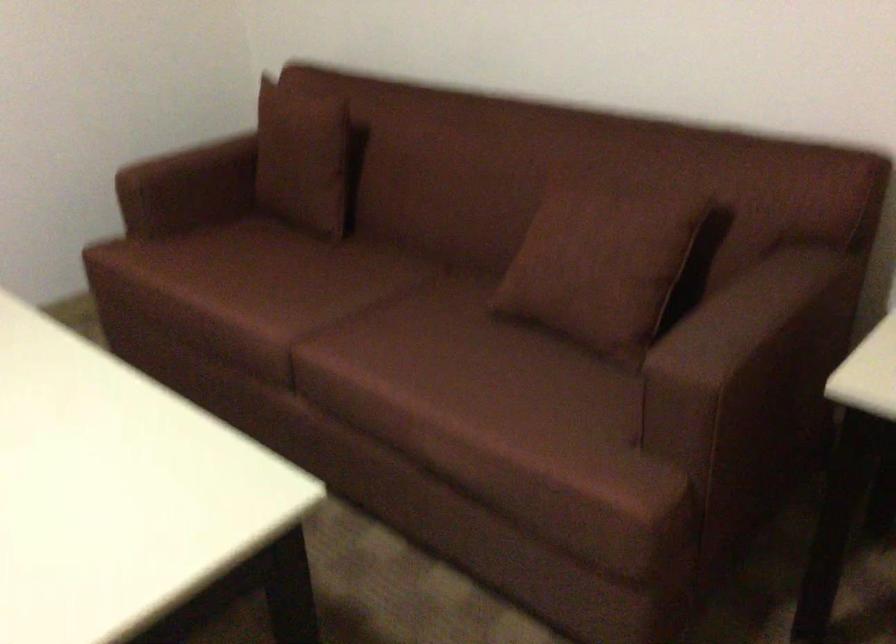
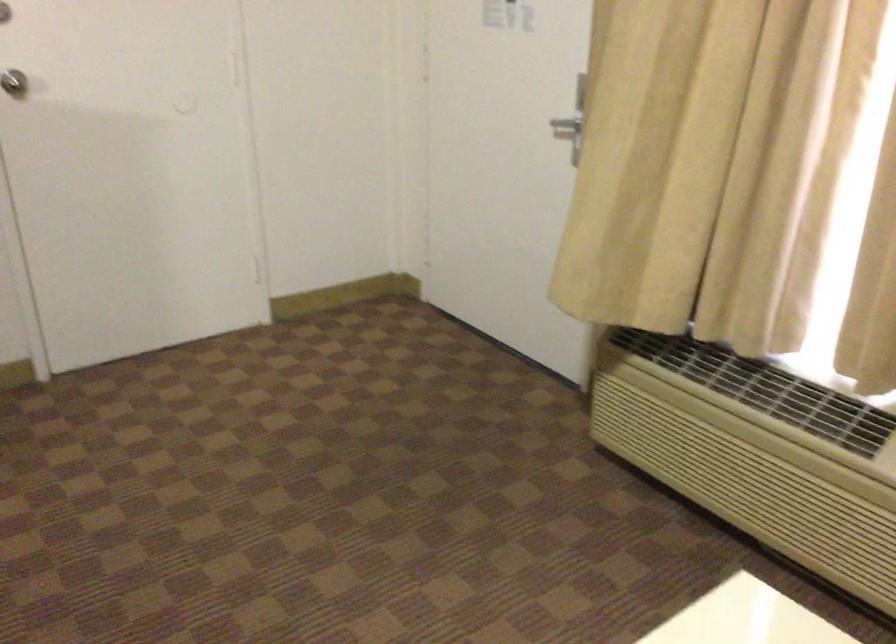
First-person continuous shooting, in which direction is the camera rotating?

The camera's rotation is toward left-down.